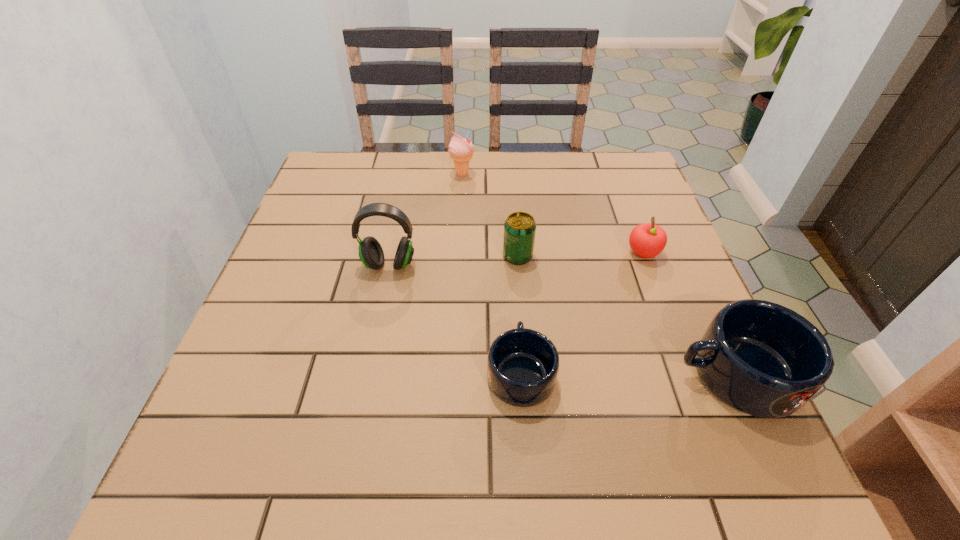
The image size is (960, 540). Identify the location of vacant region that satisfies the following two spatial constraints: 1. with the handle on the side of the beer can; 2. on the left side of the shorter mug. (512, 256).